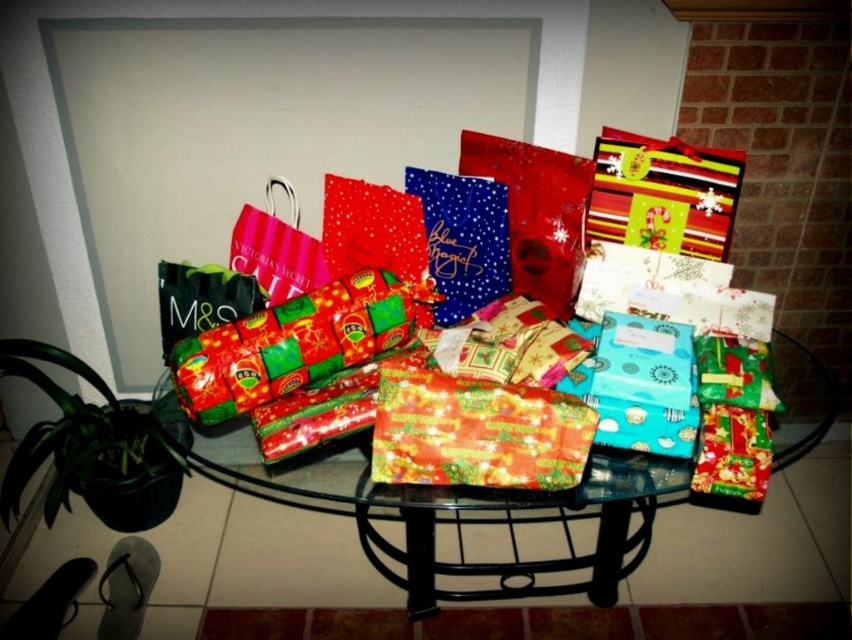
Question: In this image, where is translucent glass table at center located relative to shiny red wrapping paper at center?

Choices:
 (A) left
 (B) right

Answer: (B)

Question: Which of the following is the farthest from the observer?

Choices:
 (A) (584, 417)
 (B) (576, 509)

Answer: (B)

Question: Which of the following is the closest to the observer?

Choices:
 (A) (456, 384)
 (B) (752, 499)

Answer: (A)

Question: Does translucent glass table at center have a greater width compared to shiny red wrapping paper at center?

Choices:
 (A) no
 (B) yes

Answer: (B)

Question: Which object is closer to the camera taking this photo?

Choices:
 (A) translucent glass table at center
 (B) shiny red wrapping paper at center

Answer: (B)

Question: Is translucent glass table at center behind shiny red wrapping paper at center?

Choices:
 (A) yes
 (B) no

Answer: (A)